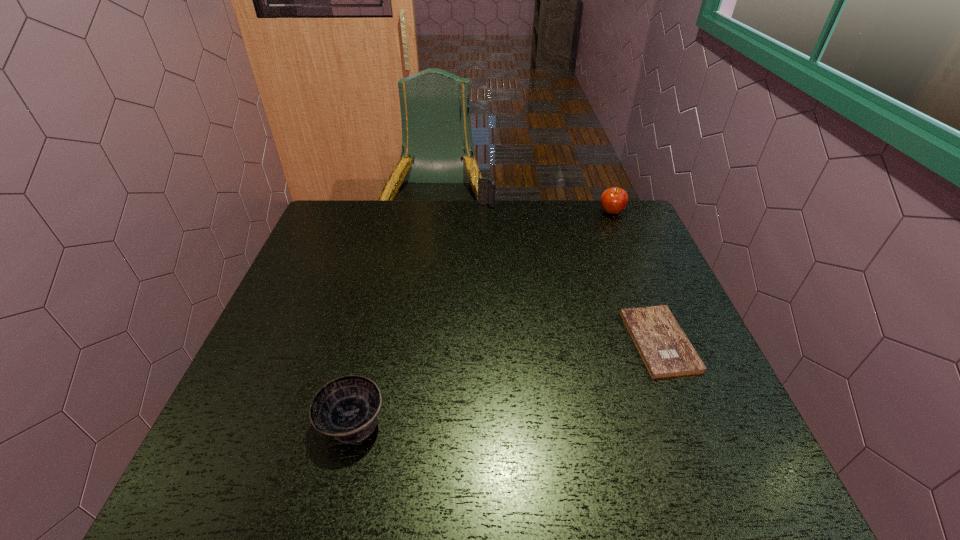
Locate an element on the screen. free space at the right edge is located at coordinates (629, 281).

Where is `vacant space at the near left corner of the desktop`? This screenshot has width=960, height=540. vacant space at the near left corner of the desktop is located at coordinates (185, 492).

At what (x,y) coordinates should I click in order to perform the action: click on empty location between the cellular telephone and the second shortest object. Please return your answer as a coordinate pair (x, y). This screenshot has width=960, height=540. Looking at the image, I should click on (420, 313).

This screenshot has height=540, width=960. Identify the location of empty location between the Bible and the tallest object. (573, 273).

Identify the location of empty space between the shortest object and the second tallest object. (636, 276).

Where is `blank region between the apple and the second object from left to right`? This screenshot has height=540, width=960. blank region between the apple and the second object from left to right is located at coordinates (549, 208).

I want to click on empty location between the second shortest object and the third farthest object, so click(x=505, y=381).

You are a GUI agent. You are given a task and a screenshot of the screen. Output one action in this format:
    pyautogui.click(x=<x>, y=<y>)
    Task: Click on the free space between the apple and the Bible
    The width and height of the screenshot is (960, 540).
    Given the screenshot: What is the action you would take?
    pyautogui.click(x=636, y=276)

At what (x,y) coordinates should I click in order to perform the action: click on free space that is in between the nearest object and the second nearest object. Please return your answer as a coordinate pair (x, y). The width and height of the screenshot is (960, 540). Looking at the image, I should click on (505, 381).

At what (x,y) coordinates should I click in order to perform the action: click on empty location between the apple and the shortest object. Please return your answer as a coordinate pair (x, y). This screenshot has width=960, height=540. Looking at the image, I should click on (636, 276).